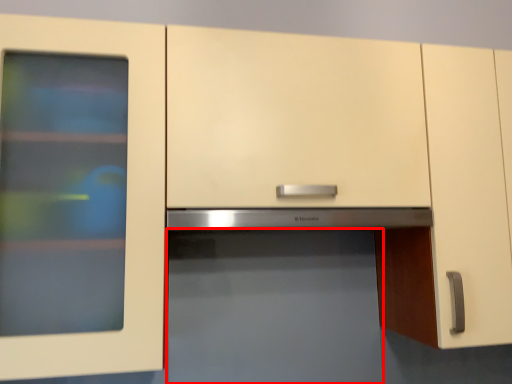
Question: Observing the image, what is the correct spatial positioning of appliance (annotated by the red box) in reference to exhaust hood?

Choices:
 (A) left
 (B) right

Answer: (B)